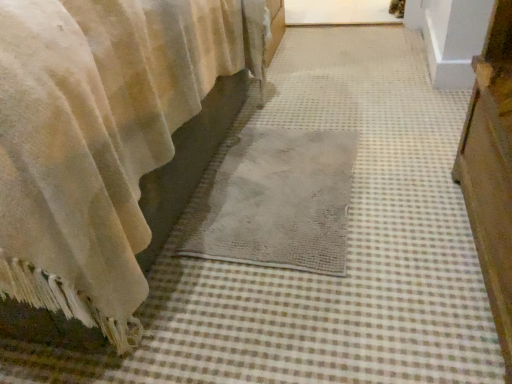
Question: In terms of height, does gray woven mat at center look taller or shorter compared to velvet beige curtain at lower left?

Choices:
 (A) tall
 (B) short

Answer: (B)

Question: Is gray woven mat at center to the left or to the right of velvet beige curtain at lower left in the image?

Choices:
 (A) right
 (B) left

Answer: (A)

Question: From the image's perspective, is gray woven mat at center positioned above or below velvet beige curtain at lower left?

Choices:
 (A) above
 (B) below

Answer: (B)

Question: In the image, is velvet beige curtain at lower left on the left side or the right side of gray woven mat at center?

Choices:
 (A) right
 (B) left

Answer: (B)

Question: Is point (4, 175) positioned closer to the camera than point (296, 157)?

Choices:
 (A) closer
 (B) farther

Answer: (A)

Question: Considering the positions of velvet beige curtain at lower left and gray woven mat at center in the image, is velvet beige curtain at lower left taller or shorter than gray woven mat at center?

Choices:
 (A) short
 (B) tall

Answer: (B)

Question: From a real-world perspective, is velvet beige curtain at lower left positioned above or below gray woven mat at center?

Choices:
 (A) above
 (B) below

Answer: (A)